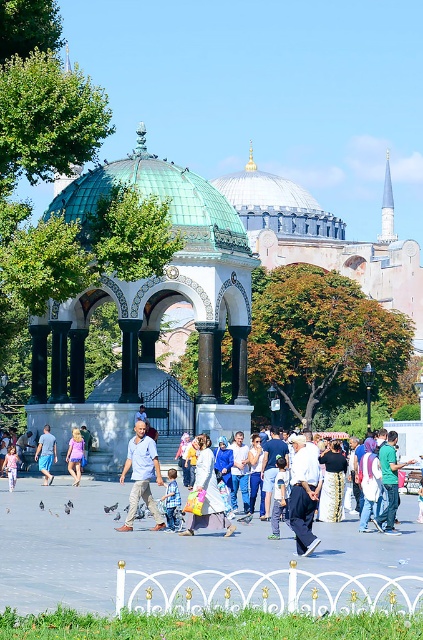
You are standing at the point marked at coordinates (159, 198) in the image. What structure are you currently standing on?

You are standing on the green copper dome at center.

You are a photographer standing in the plaza and see a person wearing a blue cotton shirt at center and denim shorts at center. Which clothing item is closer to you?

The blue cotton shirt at center is closer to you because it is in front of the denim shorts at center.

You are a photographer standing in the public square. You want to take a photo of the green copper dome at center and the denim shorts at center. Which object should you zoom in on to capture more details of its features?

The green copper dome at center is larger in size than denim shorts at center, so you should zoom in on the denim shorts at center to capture more details of its features.